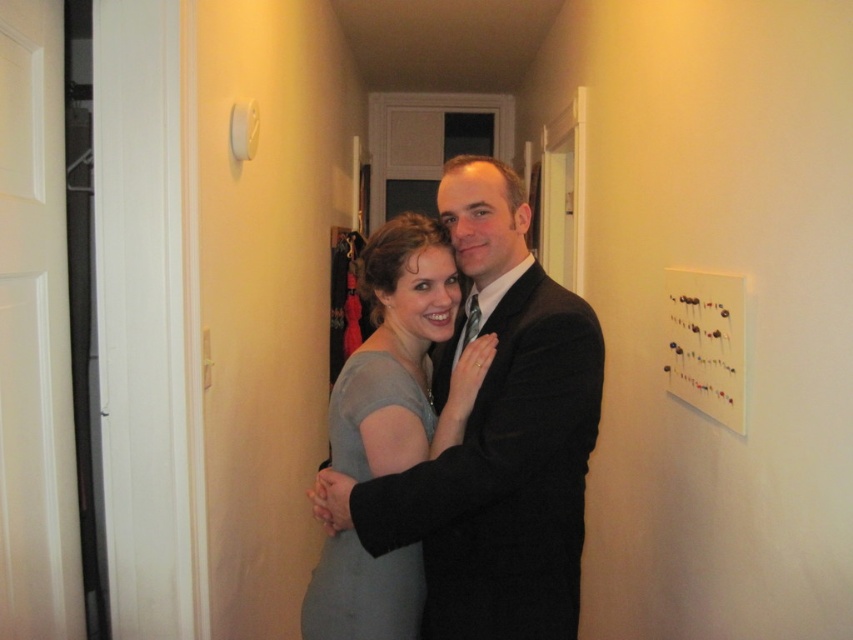
Question: Is matte gray dress at center smaller than gray matte dress at center?

Choices:
 (A) no
 (B) yes

Answer: (A)

Question: Can you confirm if matte gray dress at center is positioned above white matte bulletin board at upper right?

Choices:
 (A) yes
 (B) no

Answer: (B)

Question: Which is nearer to the matte gray dress at center?

Choices:
 (A) gray matte dress at center
 (B) white matte bulletin board at upper right

Answer: (A)

Question: Is gray matte dress at center to the left of white matte bulletin board at upper right from the viewer's perspective?

Choices:
 (A) no
 (B) yes

Answer: (B)

Question: Which point is closer to the camera taking this photo?

Choices:
 (A) (695, 356)
 (B) (381, 426)

Answer: (B)

Question: Which object is farther from the camera taking this photo?

Choices:
 (A) matte gray dress at center
 (B) gray matte dress at center

Answer: (B)